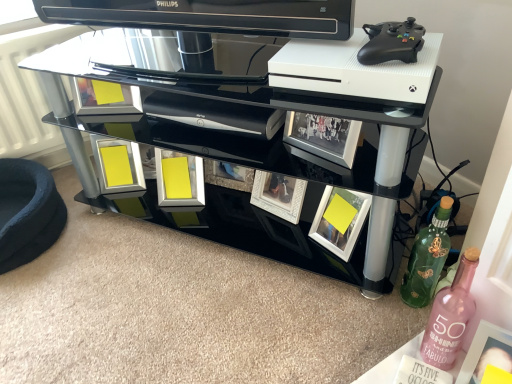
Find the location of a particular element. The image size is (512, 384). free space between matte yellow picture frame at lower center, positioned as the 2th picture frame in back-to-front order, and pink glass bottle at lower right, which is counted as the second bottle, starting from the back is located at coordinates (281, 266).